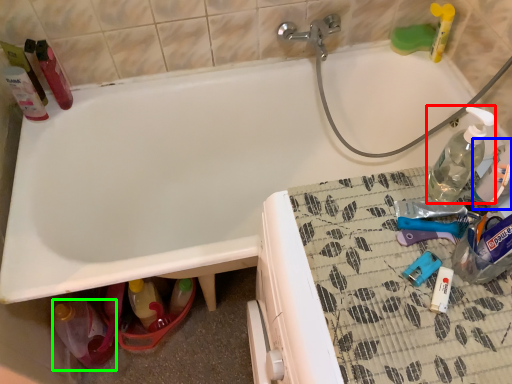
Question: Estimate the real-world distances between objects in this image. Which object is closer to bottle (highlighted by a red box), bottle (highlighted by a blue box) or bottle (highlighted by a green box)?

Choices:
 (A) bottle
 (B) bottle

Answer: (A)